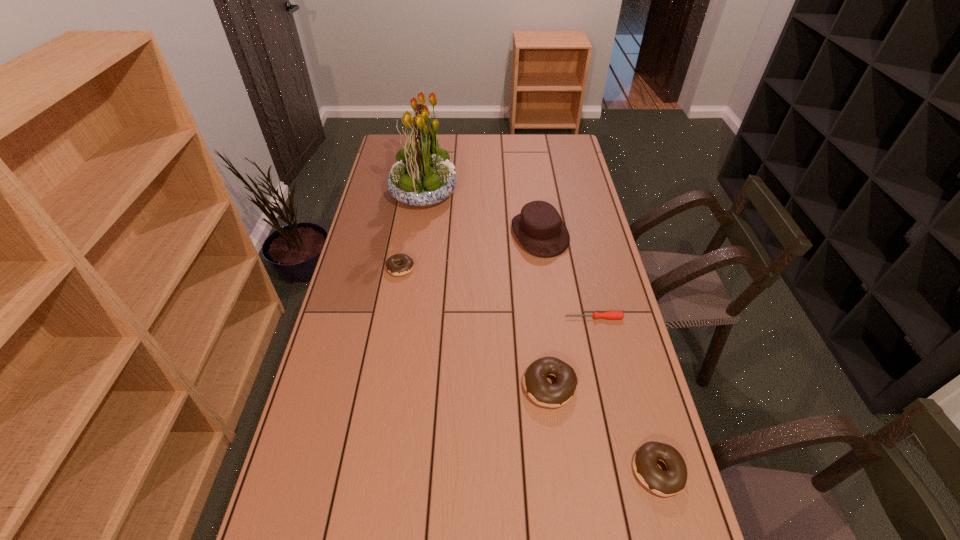
Find the location of a particular element. flower arrangement located in the left edge section of the desktop is located at coordinates (423, 175).

Identify the location of doughnut at the right edge. This screenshot has width=960, height=540. (672, 481).

Locate an element on the screen. Image resolution: width=960 pixels, height=540 pixels. hat that is at the right edge is located at coordinates (539, 228).

Find the location of a particular element. The height and width of the screenshot is (540, 960). screwdriver present at the right edge is located at coordinates (611, 315).

Image resolution: width=960 pixels, height=540 pixels. I want to click on object situated at the near right corner, so click(x=672, y=481).

Identify the location of free location at the far edge of the desktop. The height and width of the screenshot is (540, 960). (439, 140).

This screenshot has height=540, width=960. I want to click on free point at the near edge, so click(527, 529).

Where is `vacant region at the left edge`? The width and height of the screenshot is (960, 540). vacant region at the left edge is located at coordinates (333, 483).

Where is `blank space at the right edge of the desktop`? blank space at the right edge of the desktop is located at coordinates (565, 222).

Locate an element on the screen. unoccupied position between the second doughnut from right to left and the second tallest doughnut is located at coordinates (604, 428).